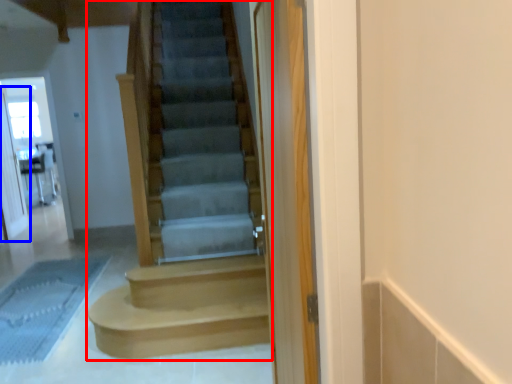
Question: Which object is further to the camera taking this photo, stairs (highlighted by a red box) or screen door (highlighted by a blue box)?

Choices:
 (A) stairs
 (B) screen door

Answer: (B)